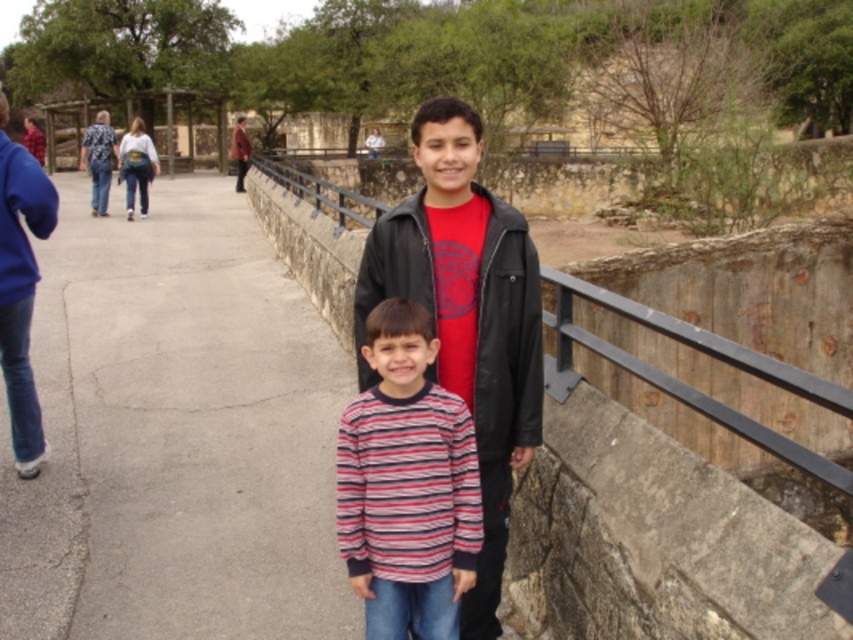
Question: Which is farther from the metallic gray rail at center?

Choices:
 (A) red plaid shirt at center
 (B) blue fleece jacket at left
 (C) black leather jacket at center
 (D) blue floral shirt at upper left

Answer: (A)

Question: Which point is farther from the camera taking this photo?

Choices:
 (A) (109, 173)
 (B) (724, 410)
 (C) (473, 435)
 (D) (238, 173)

Answer: (D)

Question: Which point is closer to the camera taking this photo?

Choices:
 (A) (32, 134)
 (B) (390, 476)
 (C) (315, 212)
 (D) (3, 244)

Answer: (B)

Question: Does metallic gray rail at center appear on the left side of brown leather jacket at center?

Choices:
 (A) yes
 (B) no

Answer: (B)

Question: In this image, where is black leather jacket at center located relative to red plaid shirt at center?

Choices:
 (A) right
 (B) left

Answer: (A)

Question: Is black leather jacket at center to the left of red plaid shirt at center from the viewer's perspective?

Choices:
 (A) yes
 (B) no

Answer: (B)